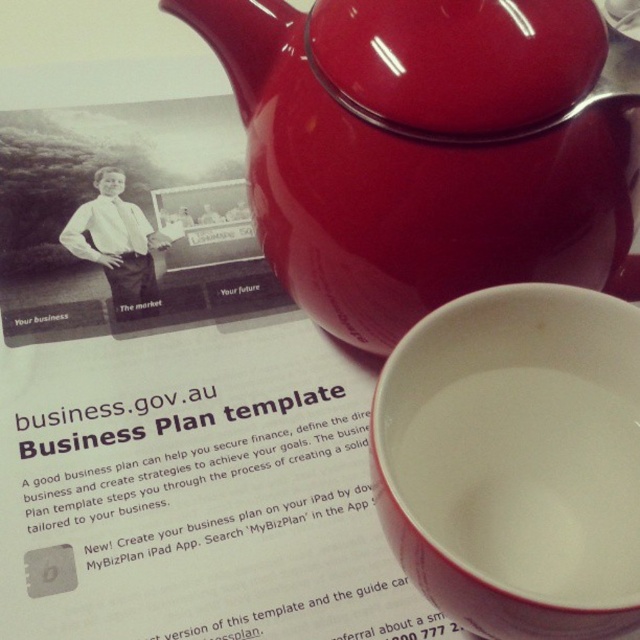
Who is higher up, glossy ceramic teapot at upper center or white glossy teacup at lower right?

glossy ceramic teapot at upper center is higher up.

Does glossy ceramic teapot at upper center have a lesser width compared to white glossy teacup at lower right?

No.

The height and width of the screenshot is (640, 640). Identify the location of glossy ceramic teapot at upper center. 432,148.